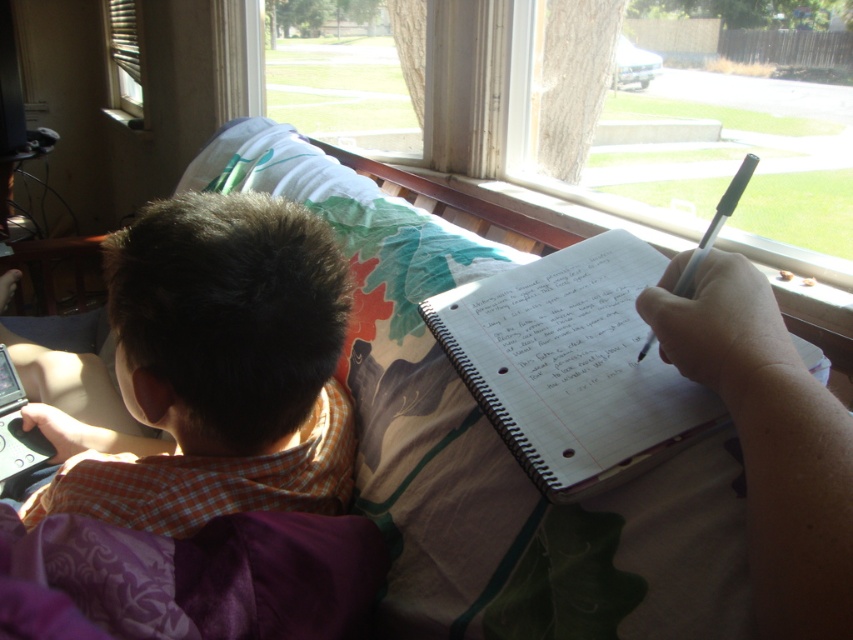
You are standing in the room and see the point marked at coordinates (215, 371). What object is located at that point?

The point at coordinates (215, 371) indicates the brown checkered shirt at left.